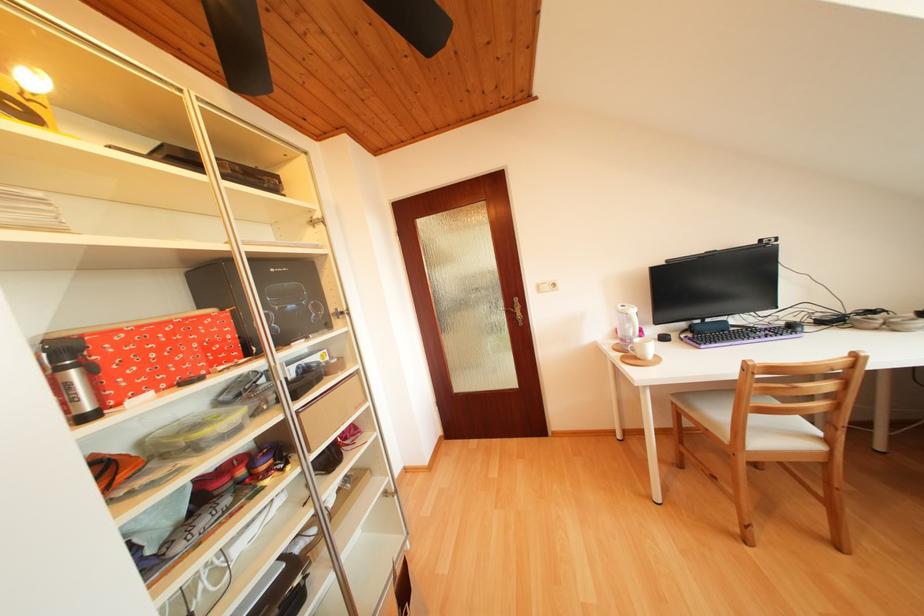
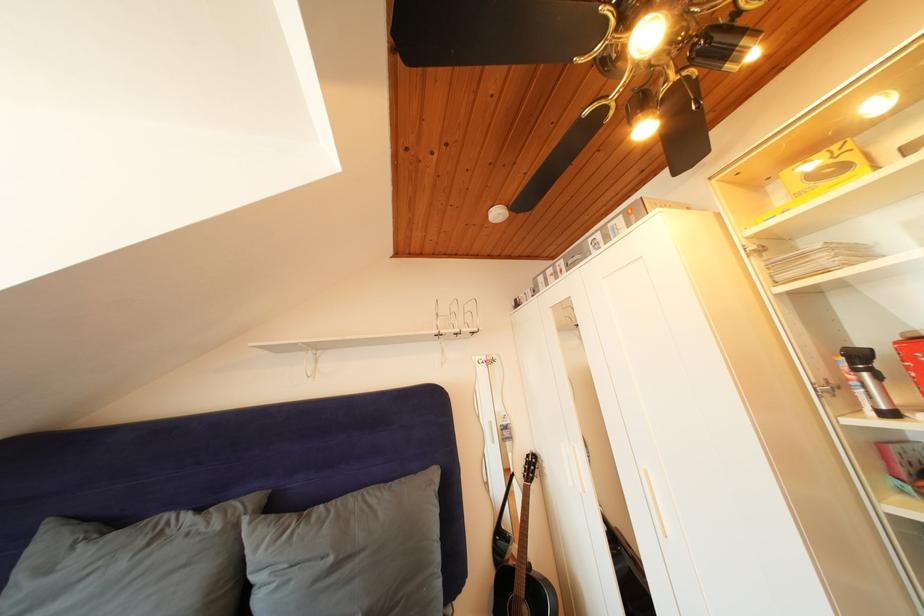
Where in the second image is the point corresponding to (x=96, y=414) from the first image?

(892, 411)